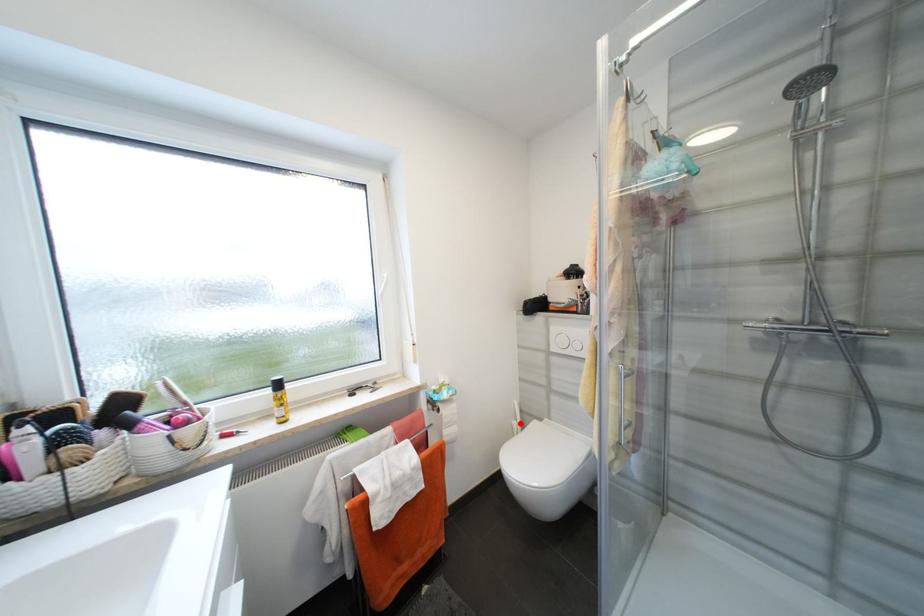
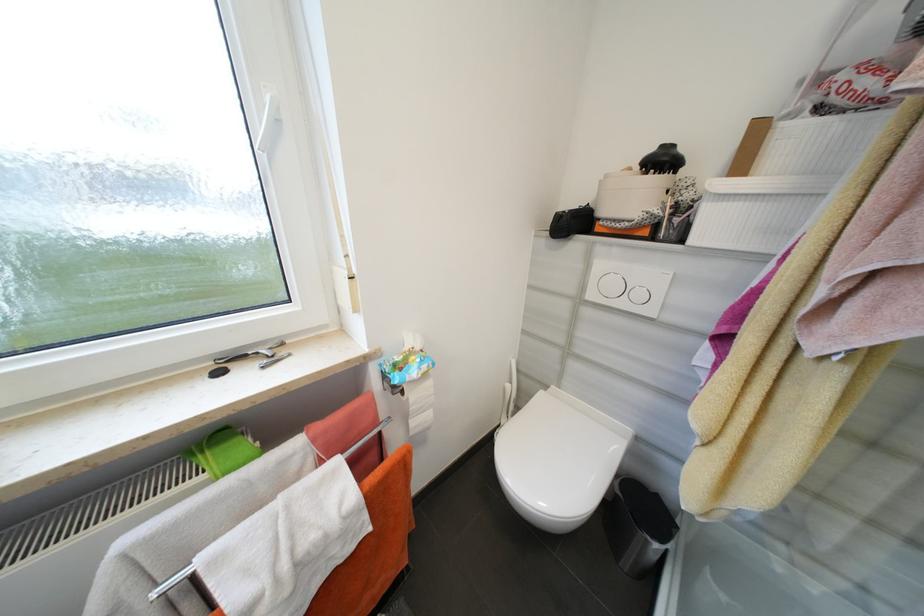
Question: I am providing you with two images of the same scene from different viewpoints. A red point is shown in image1. For the corresponding object point in image2, is it positioned nearer or farther from the camera?

Choices:
 (A) Nearer
 (B) Farther

Answer: (A)